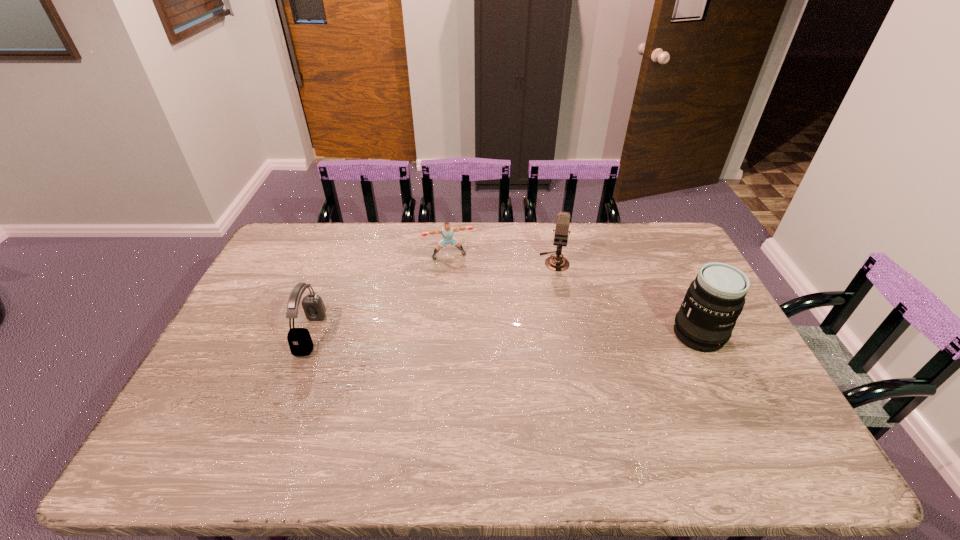
You are a GUI agent. You are given a task and a screenshot of the screen. Output one action in this format:
    pyautogui.click(x=<x>, y=<y>)
    Task: Click on the empty space between the second object from right to left and the puncher
    The height and width of the screenshot is (540, 960).
    Given the screenshot: What is the action you would take?
    pyautogui.click(x=502, y=259)

The height and width of the screenshot is (540, 960). I want to click on unoccupied area between the puncher and the telephoto lens, so click(574, 295).

This screenshot has width=960, height=540. I want to click on empty space between the third tallest object and the third object from left to right, so click(x=433, y=298).

This screenshot has width=960, height=540. I want to click on free area in between the second object from right to left and the puncher, so click(x=502, y=259).

This screenshot has height=540, width=960. I want to click on object that can be found as the second closest to the telephoto lens, so click(447, 231).

Choose which object is the third nearest neighbor to the microphone. Please provide its 2D coordinates. Your answer should be formatted as a tuple, i.e. [(x, y)], where the tuple contains the x and y coordinates of a point satisfying the conditions above.

[(300, 342)]